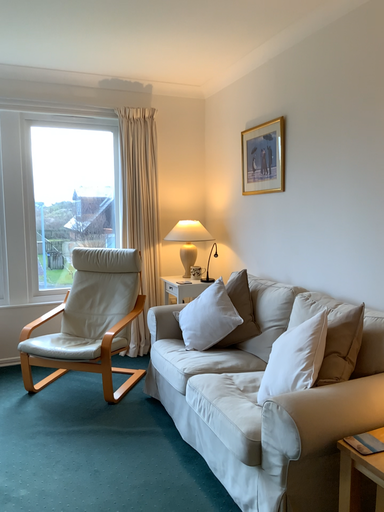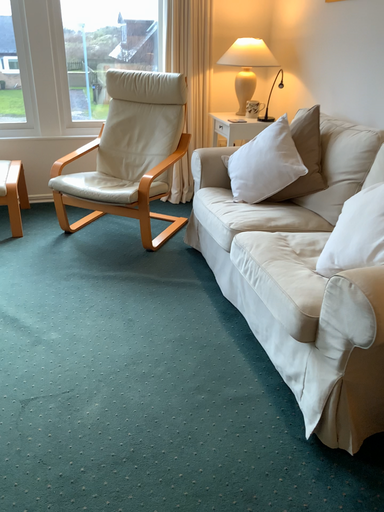
Question: How did the camera likely rotate when shooting the video?

Choices:
 (A) rotated right
 (B) rotated left

Answer: (B)